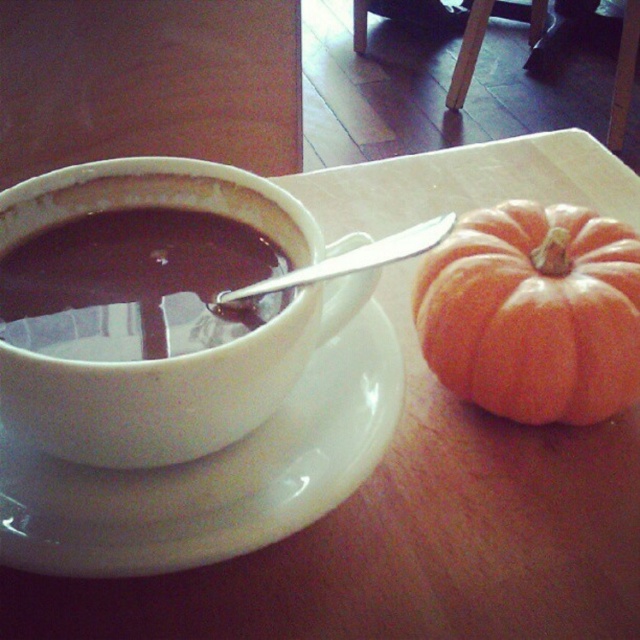
You are looking at the autumn scene with the cup of hot chocolate and the pumpkin. There are two points marked in the image. Which point is closer to you, point (340, 419) or point (420, 244)?

Point (340, 419) is closer to you than point (420, 244) because it is further to the viewer.

You have a small cookie that you want to place on the white glossy saucer at center or the satin silver spoon at upper center. Based on their sizes, which object can better accommodate the cookie?

The white glossy saucer at center is bigger than the satin silver spoon at upper center, so the cookie will fit better on the white glossy saucer at center.

You are sitting at the table and want to place a napkin between the two points on the table, point (1,444) and point (70,307). Which point should you place the napkin closer to so that it is in front of the other point?

You should place the napkin closer to point (70,307) because point (1,444) is behind it, so placing the napkin near point (70,307) will be in front of point (1,444).